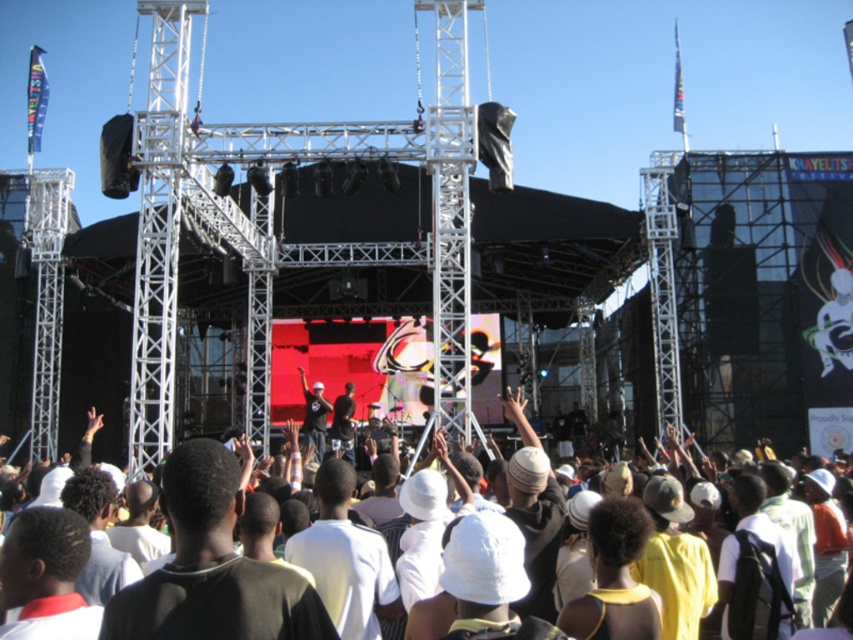
Does white cotton crowd at center appear on the right side of matte black shirt at center?

Correct, you'll find white cotton crowd at center to the right of matte black shirt at center.

Which is in front, point (88, 452) or point (310, 420)?

Point (88, 452) is more forward.

This screenshot has width=853, height=640. What do you see at coordinates (811, 524) in the screenshot? I see `white cotton crowd at center` at bounding box center [811, 524].

Find the location of `white cotton crowd at center`. white cotton crowd at center is located at coordinates (811, 524).